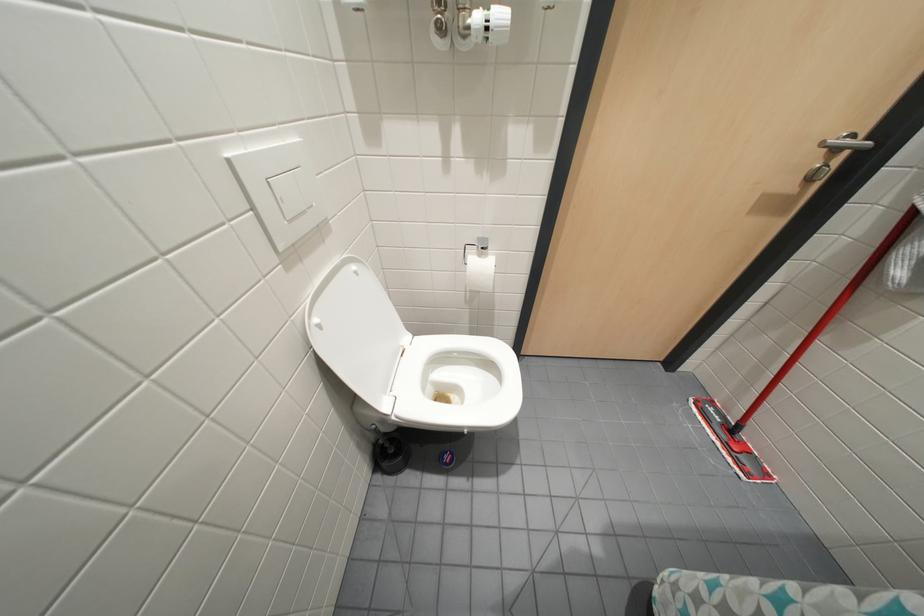
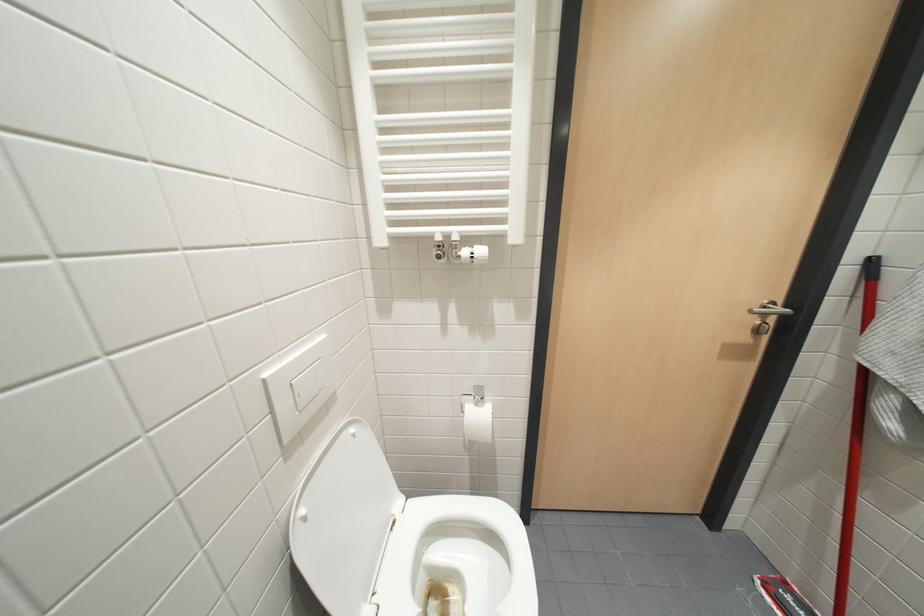
Question: The first image is from the beginning of the video and the second image is from the end. How did the camera likely rotate when shooting the video?

Choices:
 (A) Left
 (B) Right
 (C) Up
 (D) Down

Answer: (C)